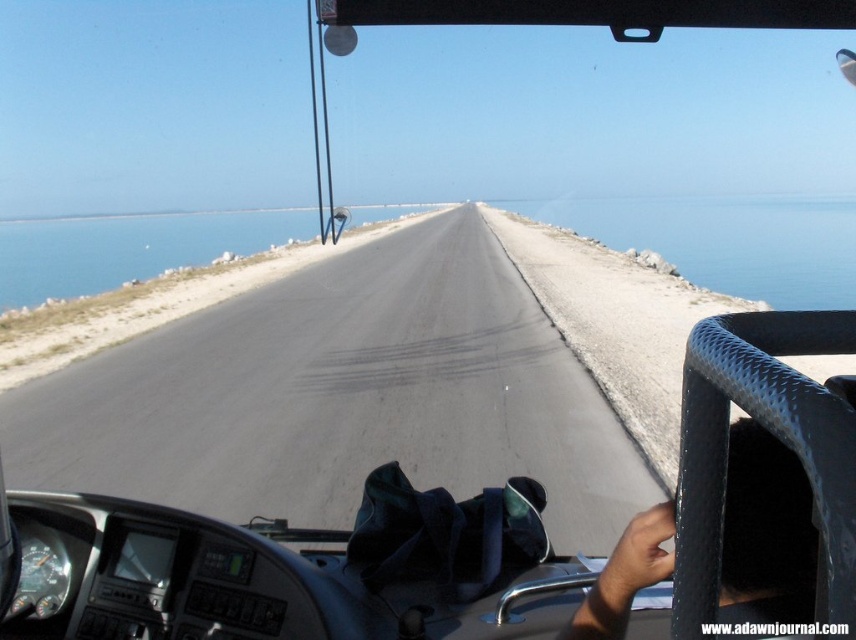
Question: Which point appears farthest from the camera in this image?

Choices:
 (A) (789, 570)
 (B) (294, 321)

Answer: (B)

Question: Which of the following is the farthest from the observer?

Choices:
 (A) dark skin textured hand at lower right
 (B) asphalt road at center

Answer: (B)

Question: Does asphalt road at center appear over dark skin textured hand at lower right?

Choices:
 (A) yes
 (B) no

Answer: (A)

Question: Does asphalt road at center appear on the right side of dark skin textured hand at lower right?

Choices:
 (A) yes
 (B) no

Answer: (B)

Question: Which object appears closest to the camera in this image?

Choices:
 (A) asphalt road at center
 (B) dark skin textured hand at lower right

Answer: (B)

Question: Is asphalt road at center positioned behind dark skin textured hand at lower right?

Choices:
 (A) no
 (B) yes

Answer: (B)